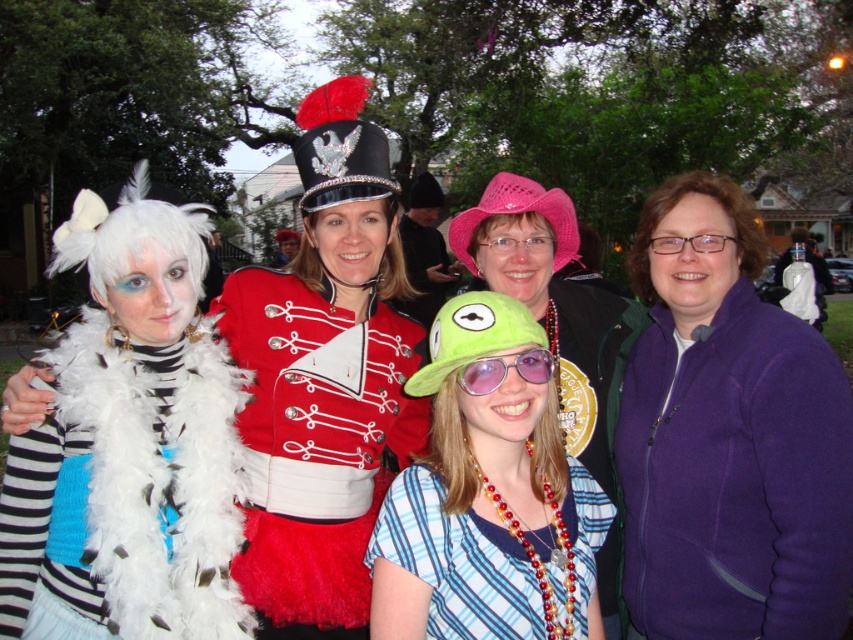
Which of these two, purple fleece jacket at center or shiny red uniform at center, stands taller?

purple fleece jacket at center

Can you confirm if purple fleece jacket at center is bigger than shiny red uniform at center?

Yes.

Does point (741, 577) come farther from viewer compared to point (306, 346)?

That is False.

Image resolution: width=853 pixels, height=640 pixels. Find the location of `purple fleece jacket at center`. purple fleece jacket at center is located at coordinates (728, 436).

Does green felt hat at center have a lesser width compared to shiny red uniform at center?

No.

Between green felt hat at center and shiny red uniform at center, which one appears on the left side from the viewer's perspective?

From the viewer's perspective, shiny red uniform at center appears more on the left side.

Locate an element on the screen. The image size is (853, 640). green felt hat at center is located at coordinates (488, 493).

Does white feather boa at left have a smaller size compared to pink knitted hat at center?

Correct, white feather boa at left occupies less space than pink knitted hat at center.

Between white feather boa at left and pink knitted hat at center, which one appears on the left side from the viewer's perspective?

From the viewer's perspective, white feather boa at left appears more on the left side.

Between point (93, 506) and point (532, 205), which one is positioned behind?

Point (532, 205)

Where is `white feather boa at left`? white feather boa at left is located at coordinates (132, 490).